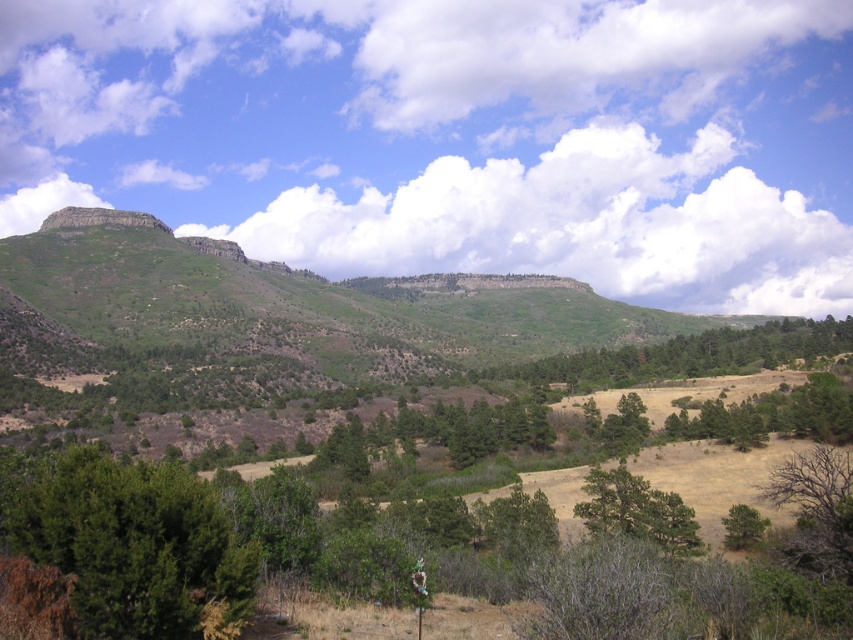
From the picture: Who is more distant from viewer, (665, 544) or (767, 524)?

Positioned behind is point (767, 524).

Locate an element on the screen. green matte tree at center is located at coordinates (637, 509).

Is point (643, 509) positioned after point (732, 512)?

Yes, it is behind point (732, 512).

Identify the location of green matte tree at center. The height and width of the screenshot is (640, 853). (637, 509).

What do you see at coordinates (135, 547) in the screenshot? The image size is (853, 640). I see `dark green textured tree at lower left` at bounding box center [135, 547].

Who is lower down, dark green textured tree at lower left or green matte tree at lower right?

green matte tree at lower right is below.

Where is `dark green textured tree at lower left`? Image resolution: width=853 pixels, height=640 pixels. dark green textured tree at lower left is located at coordinates (135, 547).

Is dark green textured tree at lower left above green matte tree at center?

Yes.

Find the location of a particular element. The width and height of the screenshot is (853, 640). dark green textured tree at lower left is located at coordinates (135, 547).